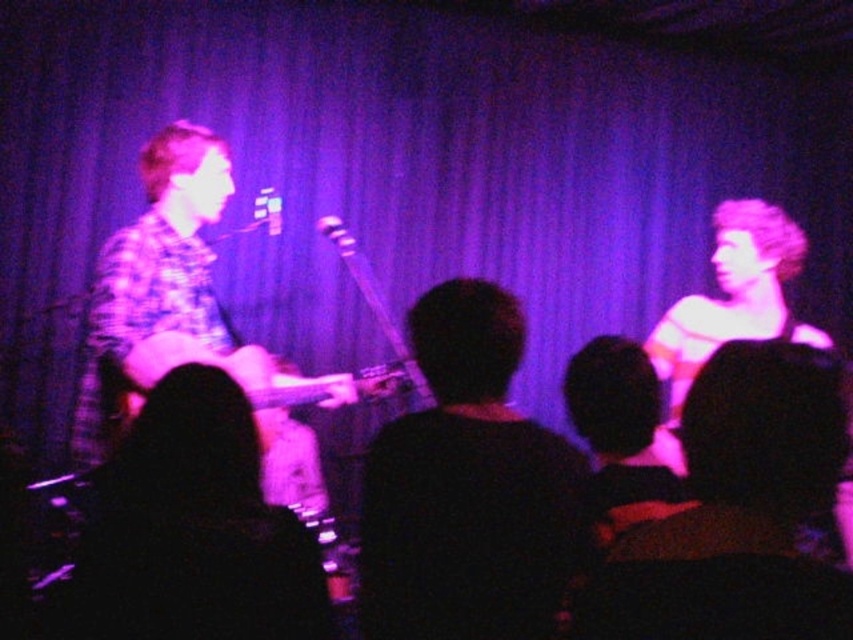
Is dark brown leather jacket at center to the right of wooden acoustic guitar at center from the viewer's perspective?

Correct, you'll find dark brown leather jacket at center to the right of wooden acoustic guitar at center.

Can you confirm if dark brown leather jacket at center is bigger than wooden acoustic guitar at center?

Incorrect, dark brown leather jacket at center is not larger than wooden acoustic guitar at center.

You are a GUI agent. You are given a task and a screenshot of the screen. Output one action in this format:
    pyautogui.click(x=<x>, y=<y>)
    Task: Click on the dark brown leather jacket at center
    Image resolution: width=853 pixels, height=640 pixels.
    Given the screenshot: What is the action you would take?
    pyautogui.click(x=468, y=488)